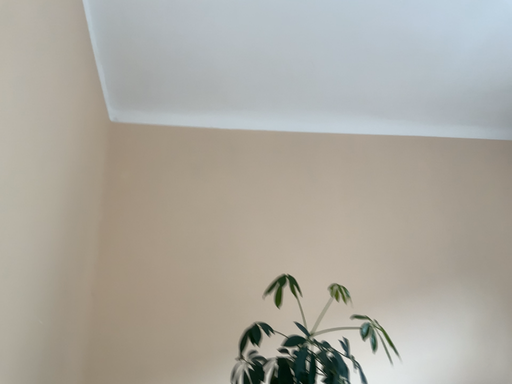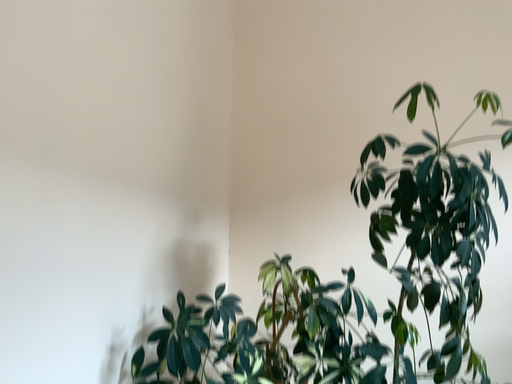
Question: Which way did the camera rotate in the video?

Choices:
 (A) rotated downward
 (B) rotated upward

Answer: (A)